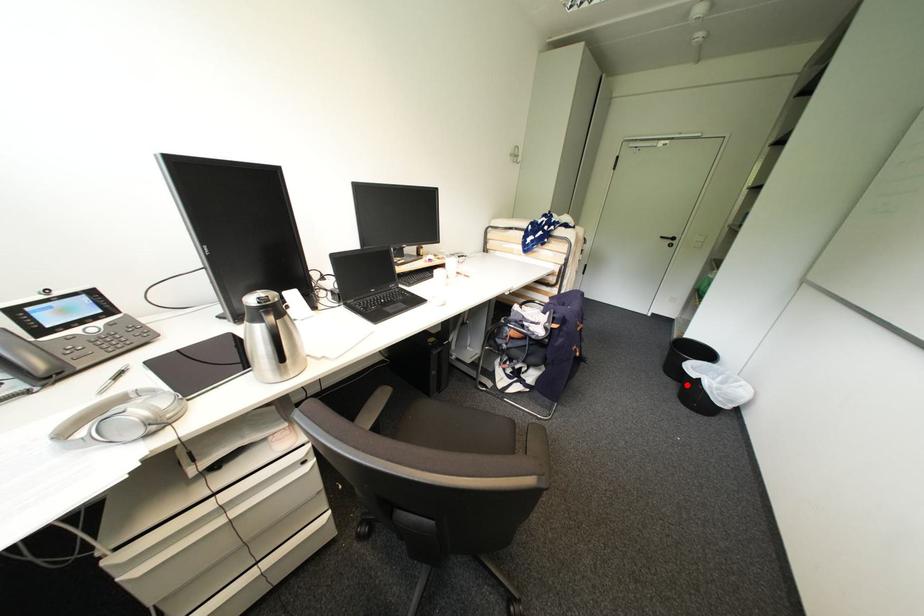
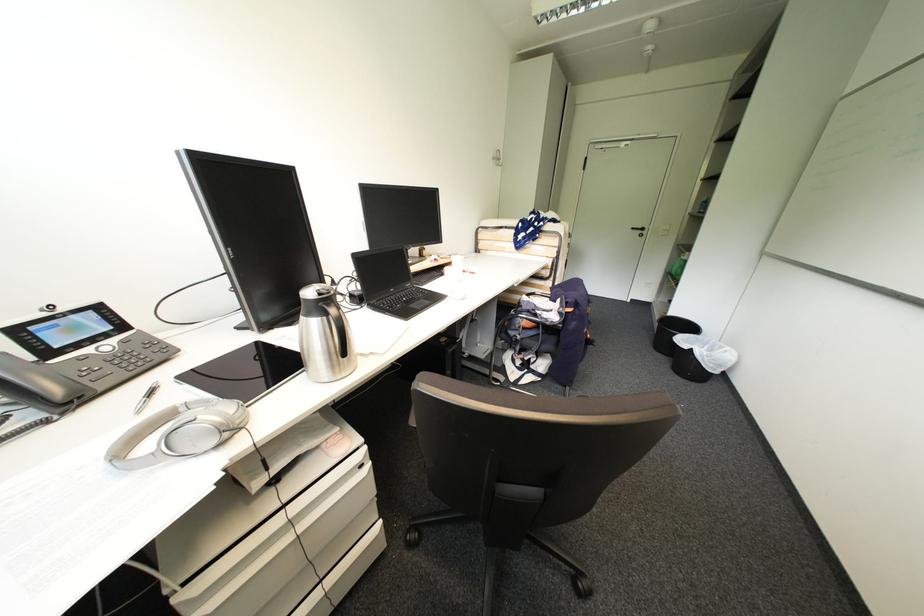
Locate, in the second image, the point that corresponds to the highlighted location in the first image.

(677, 359)